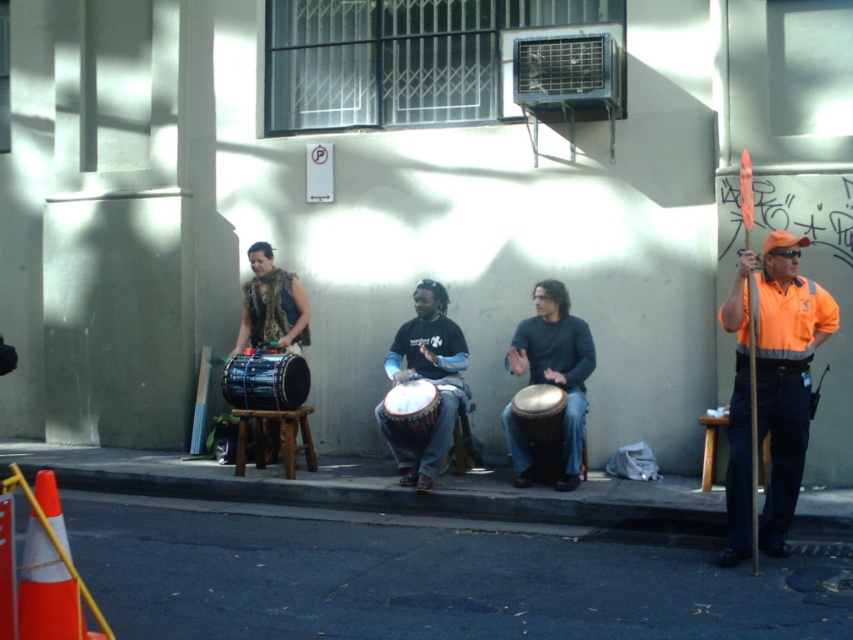
Question: Which object is the farthest from the dark gray matte drum at center?

Choices:
 (A) concrete at lower center
 (B) dark asphalt pavement at lower center

Answer: (B)

Question: Can you confirm if matte black drum at center is positioned above white textured drum at center?

Choices:
 (A) no
 (B) yes

Answer: (B)

Question: Among these objects, which one is nearest to the camera?

Choices:
 (A) dark gray matte drum at center
 (B) dark asphalt pavement at lower center

Answer: (B)

Question: Is orange high-visibility vest at right below matte black drum at center?

Choices:
 (A) no
 (B) yes

Answer: (A)

Question: Does concrete at lower center have a smaller size compared to dark gray matte drum at center?

Choices:
 (A) no
 (B) yes

Answer: (A)

Question: Among these objects, which one is farthest from the camera?

Choices:
 (A) orange high-visibility vest at right
 (B) dark gray matte drum at center
 (C) black textured drum at center
 (D) concrete at lower center

Answer: (C)